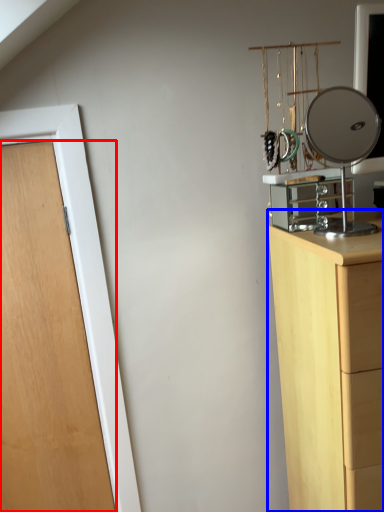
Question: Which object appears closest to the camera in this image, door (highlighted by a red box) or chest of drawers (highlighted by a blue box)?

Choices:
 (A) door
 (B) chest of drawers

Answer: (B)